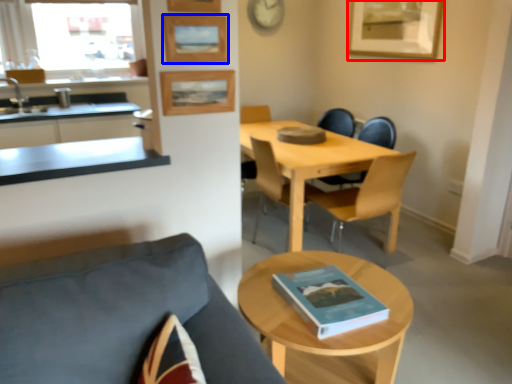
Question: Which object appears closest to the camera in this image, picture frame (highlighted by a red box) or picture frame (highlighted by a blue box)?

Choices:
 (A) picture frame
 (B) picture frame

Answer: (B)